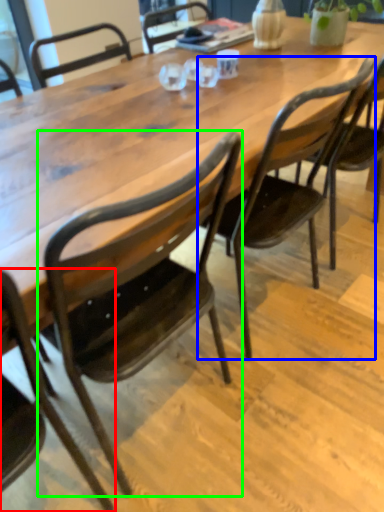
Question: Estimate the real-world distances between objects in this image. Which object is farther from chair (highlighted by a red box), chair (highlighted by a blue box) or chair (highlighted by a green box)?

Choices:
 (A) chair
 (B) chair

Answer: (A)